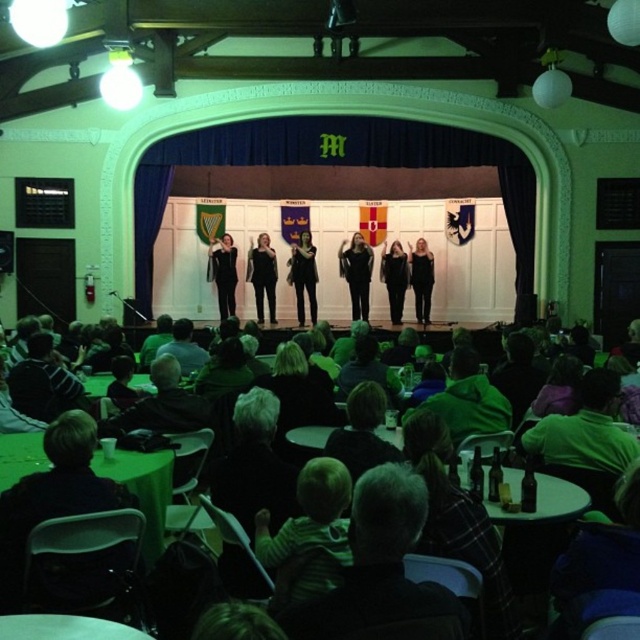
Question: Which object is closer to the camera taking this photo?

Choices:
 (A) dark gray shirt at lower left
 (B) dark gray shirt at center
 (C) black fabric dress at center

Answer: (A)

Question: Is green fuzzy jacket at center bigger than black fabric dress at center?

Choices:
 (A) no
 (B) yes

Answer: (A)

Question: Can you confirm if dark gray shirt at lower center is smaller than green fuzzy jacket at center?

Choices:
 (A) no
 (B) yes

Answer: (B)

Question: Which of the following is the farthest from the observer?

Choices:
 (A) black fabric dress at center
 (B) green fuzzy jacket at center
 (C) black matte dress at center
 (D) dark gray shirt at center

Answer: (A)

Question: Is green fuzzy jacket at center above black matte pants at center?

Choices:
 (A) no
 (B) yes

Answer: (A)

Question: Which point is closer to the camera taking this photo?

Choices:
 (A) (294, 291)
 (B) (180, 321)
 (C) (248, 252)
 (D) (449, 413)

Answer: (D)